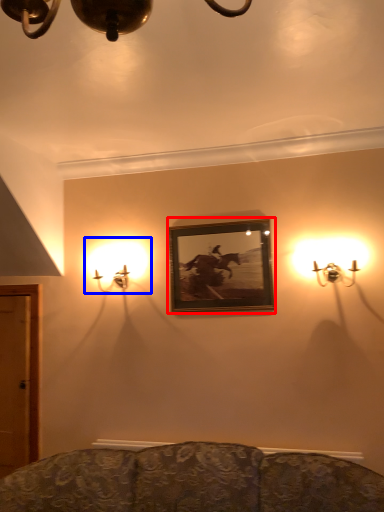
Question: Among these objects, which one is farthest to the camera, picture frame (highlighted by a red box) or lamp (highlighted by a blue box)?

Choices:
 (A) picture frame
 (B) lamp

Answer: (B)